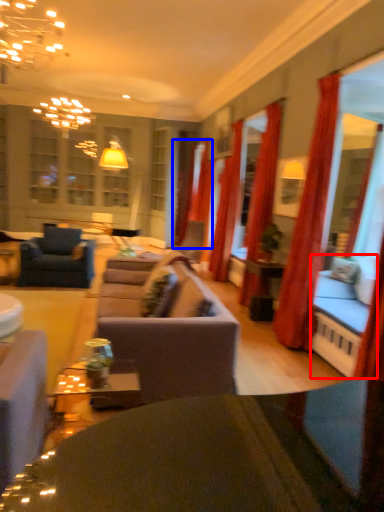
Question: Which object is further to the camera taking this photo, couch (highlighted by a red box) or curtain (highlighted by a blue box)?

Choices:
 (A) couch
 (B) curtain

Answer: (B)